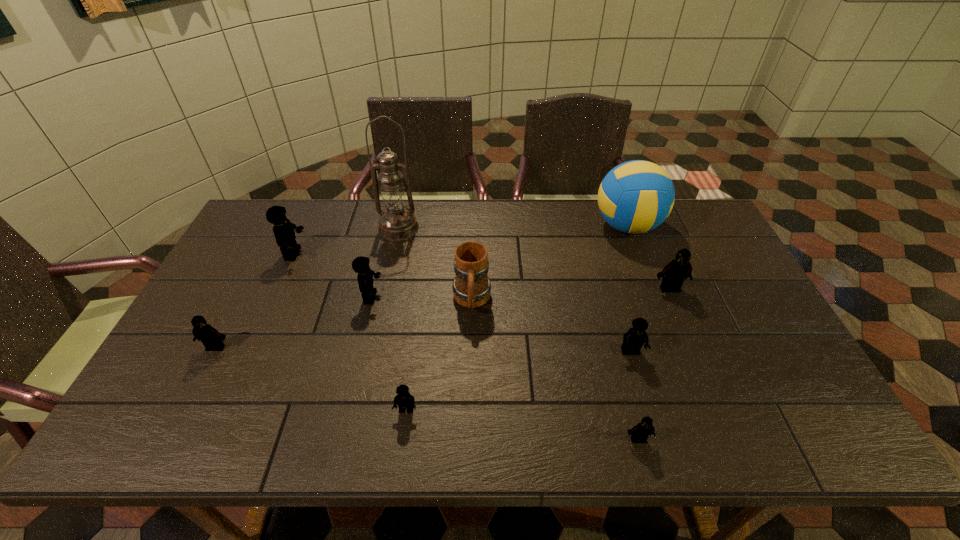
Locate an element on the screen. the tallest object is located at coordinates (396, 223).

The image size is (960, 540). What are the coordinates of `volleyball` in the screenshot? It's located at (636, 196).

Find the location of `blue volleyball`. blue volleyball is located at coordinates (636, 196).

Locate an element on the screen. the farthest Lego is located at coordinates (283, 229).

Find the location of a particular element. This screenshot has width=960, height=540. the sixth Lego from right to left is located at coordinates (283, 229).

Where is `the sixth object from left to right`? The image size is (960, 540). the sixth object from left to right is located at coordinates (471, 287).

Where is `the farthest black Lego`? the farthest black Lego is located at coordinates (673, 275).

At what (x,y) coordinates should I click in order to perform the action: click on the rightmost black Lego. Please return your answer as a coordinate pair (x, y). Image resolution: width=960 pixels, height=540 pixels. Looking at the image, I should click on (673, 275).

The width and height of the screenshot is (960, 540). In order to click on the second biggest yellow Lego in this screenshot , I will do `click(360, 265)`.

I want to click on the third Lego from left to right, so tap(360, 265).